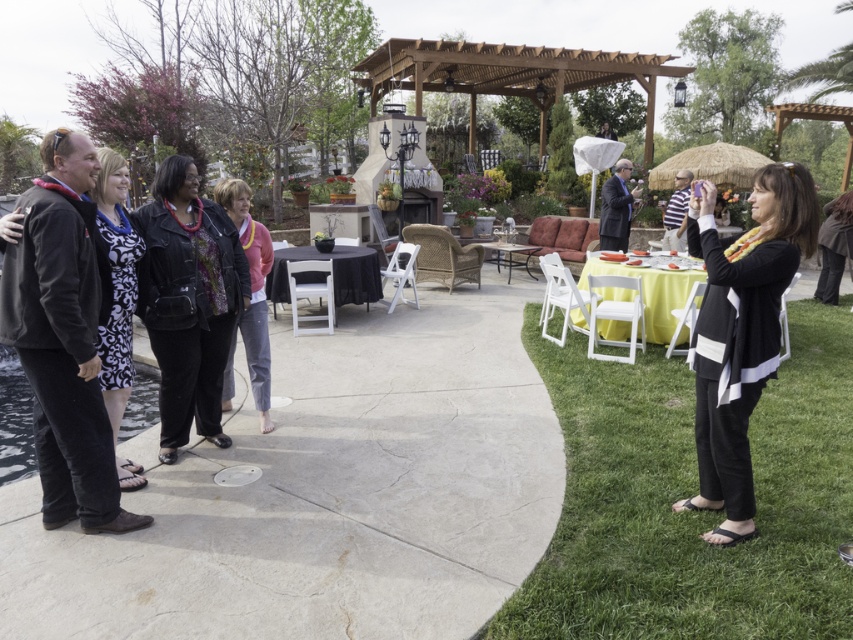
You are standing at the point with coordinates point (x=200, y=380) and want to move to the point (x=764, y=177). Which direction should you move to reach your destination?

You should move forward because point (x=764, y=177) is in front of point (x=200, y=380).